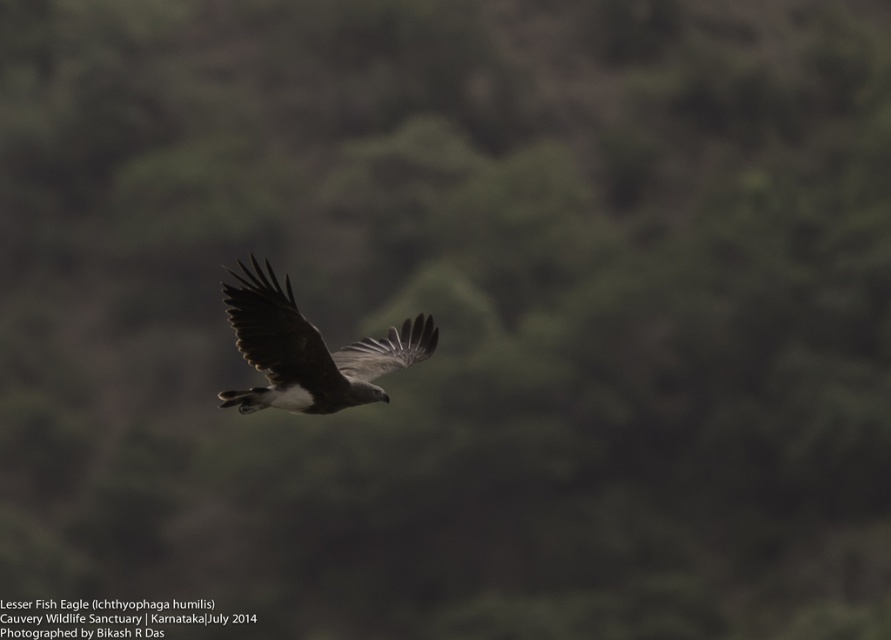
You are a photographer trying to focus on the Lesser Fish Eagle in flight. You notice two points of interest marked on your camera screen at coordinates point (287,352) and point (252,342). Which point should you prioritize focusing on to ensure the eagle remains sharp in the photo?

You should prioritize focusing on point (252,342) because it is closer to the camera than point (287,352), ensuring the eagle stays sharp.

You are a wildlife photographer trying to capture the brown feathered eagle at center and the dark gray feathered wing at center in a single frame. Which object should you focus on to ensure both are in the frame without cropping?

You should focus on the brown feathered eagle at center since it is larger in size than the dark gray feathered wing at center, ensuring both fit within the frame.